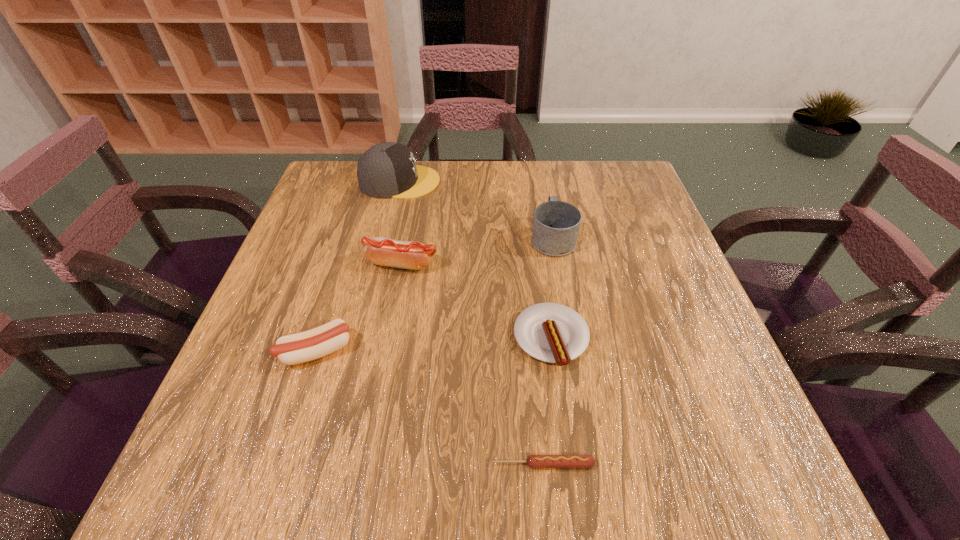
Where is `free space located on the side of the mug with the handle`? free space located on the side of the mug with the handle is located at coordinates (543, 188).

I want to click on vacant area located 0.110m on the side of the mug with the handle, so 545,194.

The width and height of the screenshot is (960, 540). Identify the location of free location located 0.210m on the side of the mug with the handle. (541, 174).

The width and height of the screenshot is (960, 540). Identify the location of vacant space located 0.060m on the back of the farthest sausage. (407, 236).

The height and width of the screenshot is (540, 960). In order to click on vacant region located 0.090m on the right of the fourth tallest object in this screenshot , I will do `click(398, 351)`.

Where is `free location located 0.390m on the left of the third tallest sausage`? The width and height of the screenshot is (960, 540). free location located 0.390m on the left of the third tallest sausage is located at coordinates (314, 338).

Identify the location of free space located on the left of the nearest sausage. (435, 464).

Locate an element on the screen. The height and width of the screenshot is (540, 960). object located at the far edge is located at coordinates (386, 170).

You are a GUI agent. You are given a task and a screenshot of the screen. Output one action in this format:
    pyautogui.click(x=<x>, y=<y>)
    Task: Click on the object at the near edge
    Image resolution: width=960 pixels, height=540 pixels.
    Given the screenshot: What is the action you would take?
    pyautogui.click(x=533, y=461)

Image resolution: width=960 pixels, height=540 pixels. In order to click on cap that is positioned at the left edge in this screenshot , I will do `click(386, 170)`.